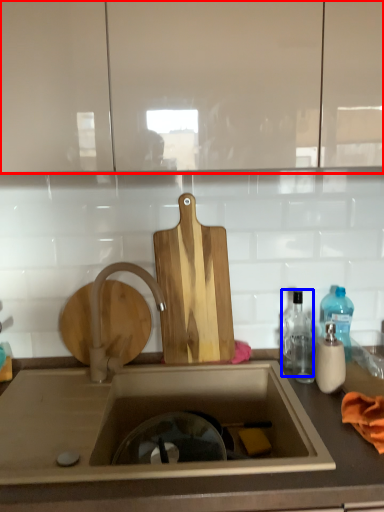
Question: Which point is closer to the camera, cabinetry (highlighted by a red box) or bottle (highlighted by a blue box)?

Choices:
 (A) cabinetry
 (B) bottle

Answer: (A)